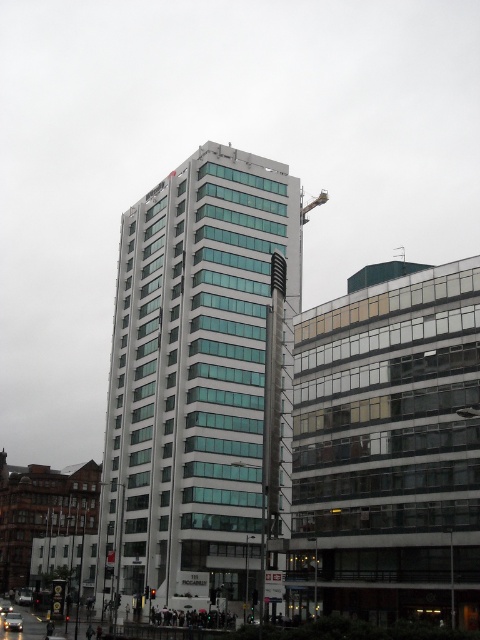
The image size is (480, 640). What do you see at coordinates (195, 381) in the screenshot?
I see `white glass building at center` at bounding box center [195, 381].

Does point (262, 272) come closer to viewer compared to point (1, 612)?

No, it is behind (1, 612).

Where is `white glass building at center`? white glass building at center is located at coordinates (195, 381).

Is point (4, 627) positioned after point (4, 609)?

No, (4, 627) is closer to viewer.

Is metallic silver car at center closer to camera compared to metallic silver car at lower left?

Yes, it is in front of metallic silver car at lower left.

What are the coordinates of `metallic silver car at center` in the screenshot? It's located at (12, 621).

This screenshot has width=480, height=640. I want to click on metallic silver car at center, so [12, 621].

Can you confirm if white glass building at center is positioned below metallic silver car at center?

No, white glass building at center is not below metallic silver car at center.

What do you see at coordinates (195, 381) in the screenshot?
I see `white glass building at center` at bounding box center [195, 381].

Is point (143, 557) less distant than point (14, 618)?

No, (143, 557) is further to viewer.

The height and width of the screenshot is (640, 480). In order to click on white glass building at center in this screenshot , I will do `click(195, 381)`.